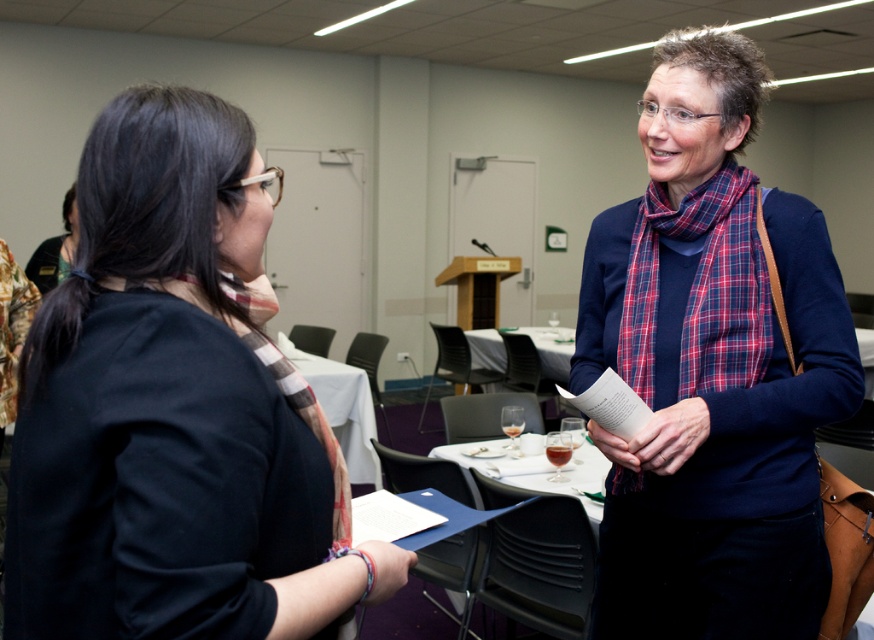
Find the location of a particular element. The width and height of the screenshot is (874, 640). matte black shirt at left is located at coordinates (172, 410).

Consider the image. Who is lower down, matte black shirt at left or white glossy table at center?

white glossy table at center is lower down.

This screenshot has width=874, height=640. Find the location of `matte black shirt at left`. matte black shirt at left is located at coordinates (172, 410).

Between blue sweater at center and white glossy table at center, which one has less height?

white glossy table at center

What do you see at coordinates (712, 371) in the screenshot? I see `blue sweater at center` at bounding box center [712, 371].

Between point (642, 120) and point (473, 333), which one is positioned behind?

Positioned behind is point (473, 333).

Image resolution: width=874 pixels, height=640 pixels. Identify the location of blue sweater at center. (712, 371).

In the scene shown: Can you confirm if white clothed table at center is positioned above white glossy table at center?

No.

Is white clothed table at center positioned at the back of white glossy table at center?

No, white clothed table at center is in front of white glossy table at center.

Does point (297, 362) come farther from viewer compared to point (560, 378)?

No.

The height and width of the screenshot is (640, 874). Identify the location of white clothed table at center. (341, 406).